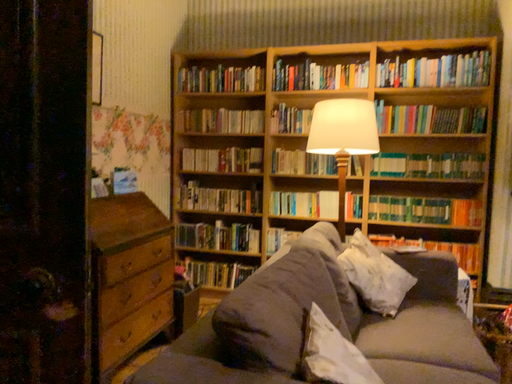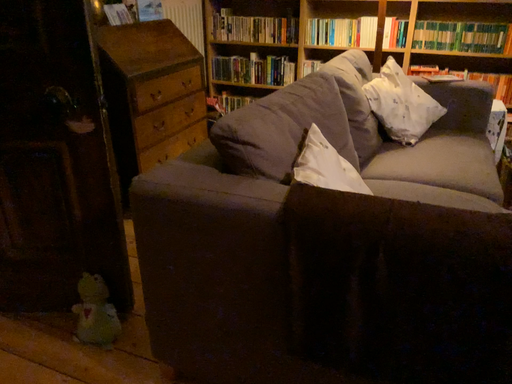
Question: Which way did the camera rotate in the video?

Choices:
 (A) rotated upward
 (B) rotated downward

Answer: (B)